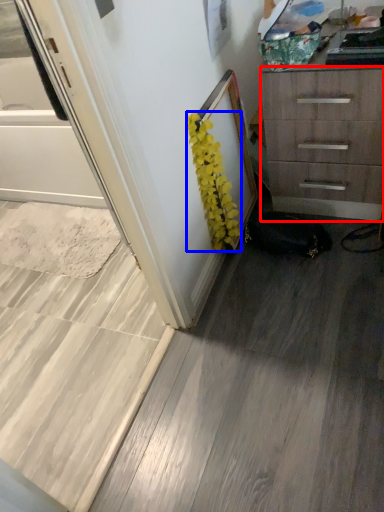
Question: Among these objects, which one is nearest to the camera, chest of drawers (highlighted by a red box) or flower (highlighted by a blue box)?

Choices:
 (A) chest of drawers
 (B) flower

Answer: (A)